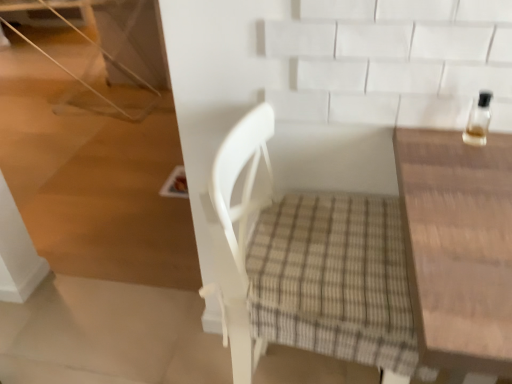
Question: Is white woven chair at center wider or thinner than clear glass bottle at upper right?

Choices:
 (A) thin
 (B) wide

Answer: (B)

Question: Considering the positions of point (266, 135) and point (480, 140), is point (266, 135) closer or farther from the camera than point (480, 140)?

Choices:
 (A) farther
 (B) closer

Answer: (A)

Question: Which object is positioned closest to the wooden table at right?

Choices:
 (A) clear glass bottle at upper right
 (B) white woven chair at center

Answer: (A)

Question: Which is nearer to the white woven chair at center?

Choices:
 (A) clear glass bottle at upper right
 (B) wooden table at right

Answer: (B)